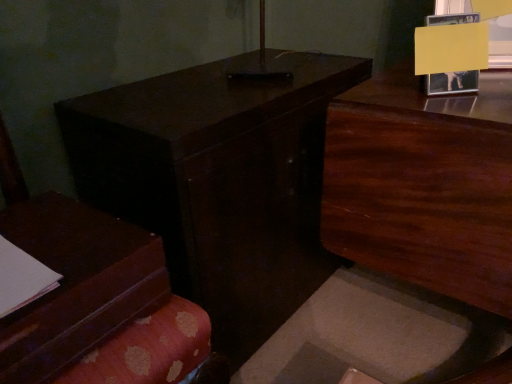
Question: Is dark wood table at center oriented away from matte brown book at left?

Choices:
 (A) no
 (B) yes

Answer: (A)

Question: Does dark wood table at center touch matte brown book at left?

Choices:
 (A) no
 (B) yes

Answer: (A)

Question: Does dark wood table at center have a larger size compared to matte brown book at left?

Choices:
 (A) yes
 (B) no

Answer: (A)

Question: Is dark wood table at center behind matte brown book at left?

Choices:
 (A) yes
 (B) no

Answer: (A)

Question: Would you say dark wood table at center is a long distance from matte brown book at left?

Choices:
 (A) no
 (B) yes

Answer: (A)

Question: Is dark wood table at center closer to camera compared to matte brown book at left?

Choices:
 (A) yes
 (B) no

Answer: (B)

Question: Is dark wood dresser at upper right wider than dark wood table at center?

Choices:
 (A) no
 (B) yes

Answer: (B)

Question: Considering the relative sizes of dark wood dresser at upper right and dark wood table at center in the image provided, is dark wood dresser at upper right taller than dark wood table at center?

Choices:
 (A) no
 (B) yes

Answer: (B)

Question: Considering the relative sizes of dark wood dresser at upper right and dark wood table at center in the image provided, is dark wood dresser at upper right smaller than dark wood table at center?

Choices:
 (A) no
 (B) yes

Answer: (B)

Question: Is dark wood dresser at upper right shorter than dark wood table at center?

Choices:
 (A) no
 (B) yes

Answer: (A)

Question: From the image's perspective, is dark wood dresser at upper right located beneath dark wood table at center?

Choices:
 (A) no
 (B) yes

Answer: (B)

Question: Would you say dark wood dresser at upper right is outside dark wood table at center?

Choices:
 (A) no
 (B) yes

Answer: (B)

Question: Can you confirm if matte brown book at left is positioned to the right of dark wood dresser at upper right?

Choices:
 (A) yes
 (B) no

Answer: (B)